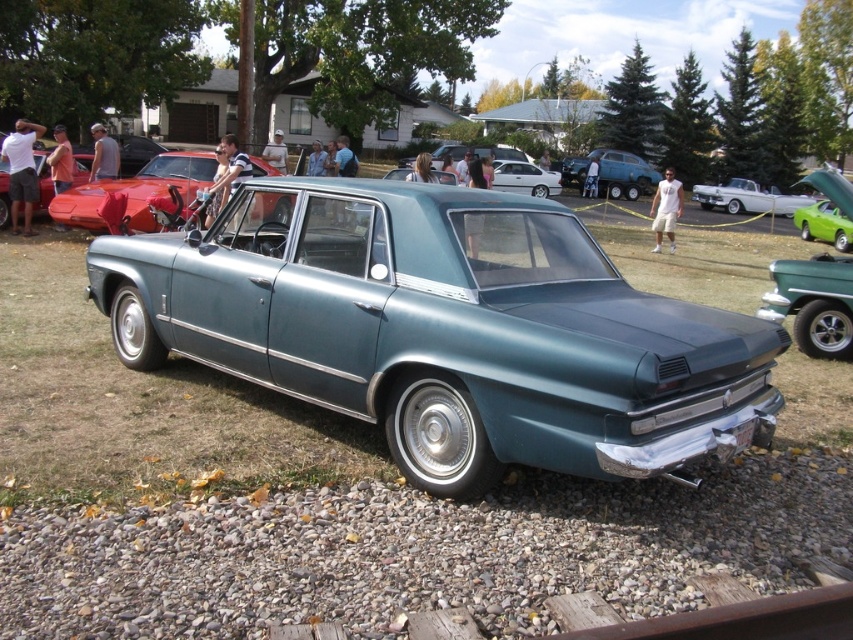
Question: Which object appears closest to the camera in this image?

Choices:
 (A) teal metallic sedan at center
 (B) metallic teal sedan at center
 (C) shiny red car at center
 (D) white glossy convertible at upper right

Answer: (B)

Question: Does metallic teal sedan at center appear over white glossy convertible at upper right?

Choices:
 (A) yes
 (B) no

Answer: (B)

Question: Which point is farther from the camera taking this photo?

Choices:
 (A) (144, 179)
 (B) (634, 156)
 (C) (821, 342)

Answer: (B)

Question: Observing the image, what is the correct spatial positioning of metallic green car at center in reference to teal metallic sedan at center?

Choices:
 (A) above
 (B) below

Answer: (B)

Question: Which object is farther from the camera taking this photo?

Choices:
 (A) white glossy convertible at upper right
 (B) metallic teal sedan at center
 (C) teal metallic sedan at center

Answer: (C)

Question: Can you confirm if shiny red car at center is positioned above metallic green car at center?

Choices:
 (A) yes
 (B) no

Answer: (A)